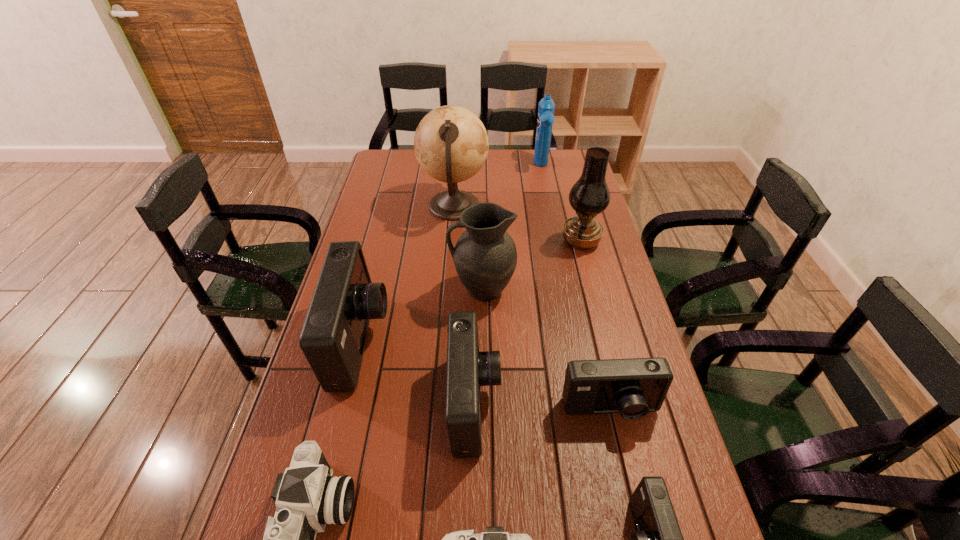
Image resolution: width=960 pixels, height=540 pixels. Find the location of `the fourth closest object to the biggest blue camera`. the fourth closest object to the biggest blue camera is located at coordinates (451, 144).

You are a GUI agent. You are given a task and a screenshot of the screen. Output one action in this format:
    pyautogui.click(x=<x>, y=<y>)
    Task: Click on the object that is the sixth nearest to the left black camera
    
    Given the screenshot: What is the action you would take?
    pyautogui.click(x=658, y=539)

Where is `camera that is the closest to the pitcher`? The width and height of the screenshot is (960, 540). camera that is the closest to the pitcher is located at coordinates (467, 369).

Point out which camera is positioned as the fifth nearest to the smallest blue camera. Please provide its 2D coordinates. Your answer should be formatted as a tuple, i.e. [(x, y)], where the tuple contains the x and y coordinates of a point satisfying the conditions above.

[(333, 336)]

Identify which blue camera is located as the third nearest to the brown oil lamp. Please provide its 2D coordinates. Your answer should be formatted as a tuple, i.e. [(x, y)], where the tuple contains the x and y coordinates of a point satisfying the conditions above.

[(333, 336)]

I want to click on blue camera that is the fourth closest to the brown oil lamp, so click(658, 539).

Locate an element on the screen. Image resolution: width=960 pixels, height=540 pixels. blank space that satisfies the following two spatial constraints: 1. on the front side of the shampoo; 2. on the front-facing side of the sixth shortest object is located at coordinates (576, 342).

Where is `free spot that satisfies the following two spatial constraints: 1. on the front side of the oil lamp; 2. on the right side of the farthest object`? This screenshot has width=960, height=540. free spot that satisfies the following two spatial constraints: 1. on the front side of the oil lamp; 2. on the right side of the farthest object is located at coordinates pyautogui.click(x=556, y=241).

Where is `free location that satisfies the following two spatial constraints: 1. on the front-facing side of the oil lamp; 2. on the left side of the globe`? This screenshot has width=960, height=540. free location that satisfies the following two spatial constraints: 1. on the front-facing side of the oil lamp; 2. on the left side of the globe is located at coordinates (451, 241).

At what (x,y) coordinates should I click in order to perform the action: click on vacant space that satisfies the following two spatial constraints: 1. on the front-facing side of the oil lamp; 2. on the right side of the globe. Please return your answer as a coordinate pair (x, y). The image size is (960, 540). Looking at the image, I should click on (451, 241).